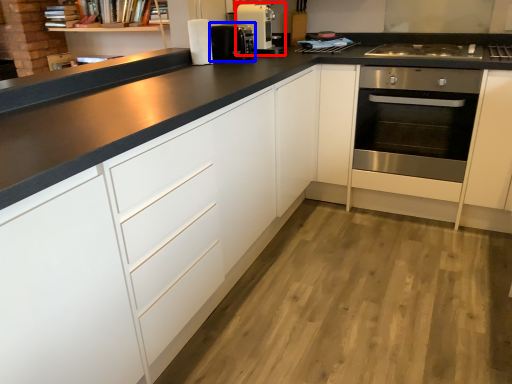
Question: Among these objects, which one is farthest to the camera, home appliance (highlighted by a red box) or coffee machine (highlighted by a blue box)?

Choices:
 (A) home appliance
 (B) coffee machine

Answer: (A)